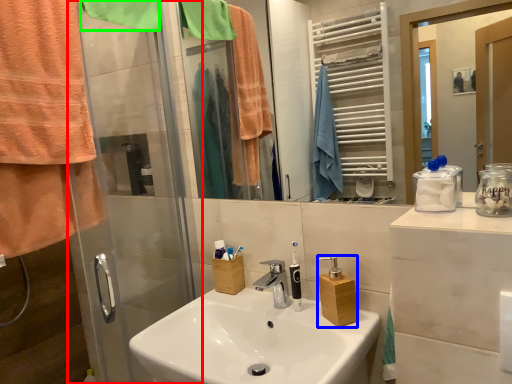
Question: Estimate the real-world distances between objects in this image. Which object is closer to shower door (highlighted by a red box), bottle (highlighted by a blue box) or towel/napkin (highlighted by a green box)?

Choices:
 (A) bottle
 (B) towel/napkin

Answer: (B)